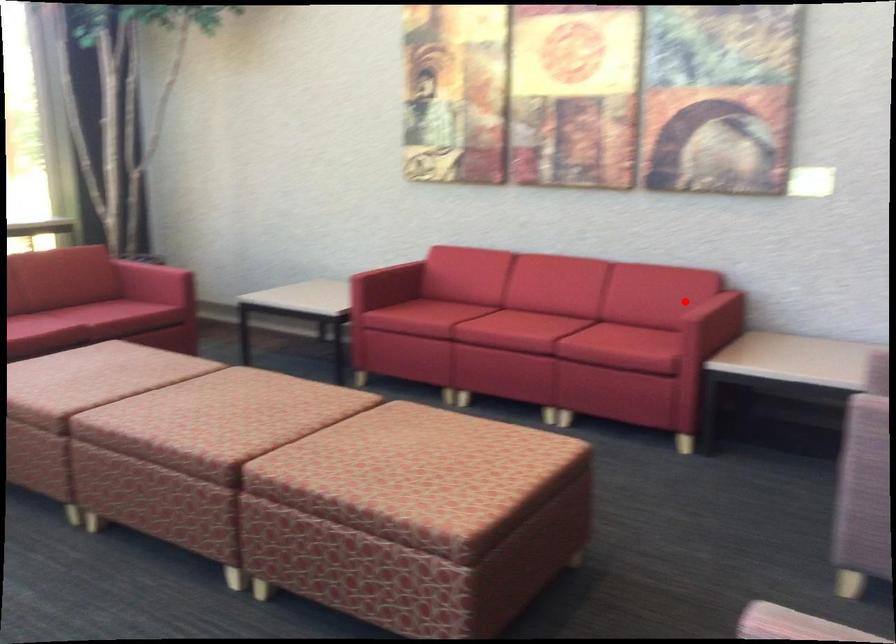
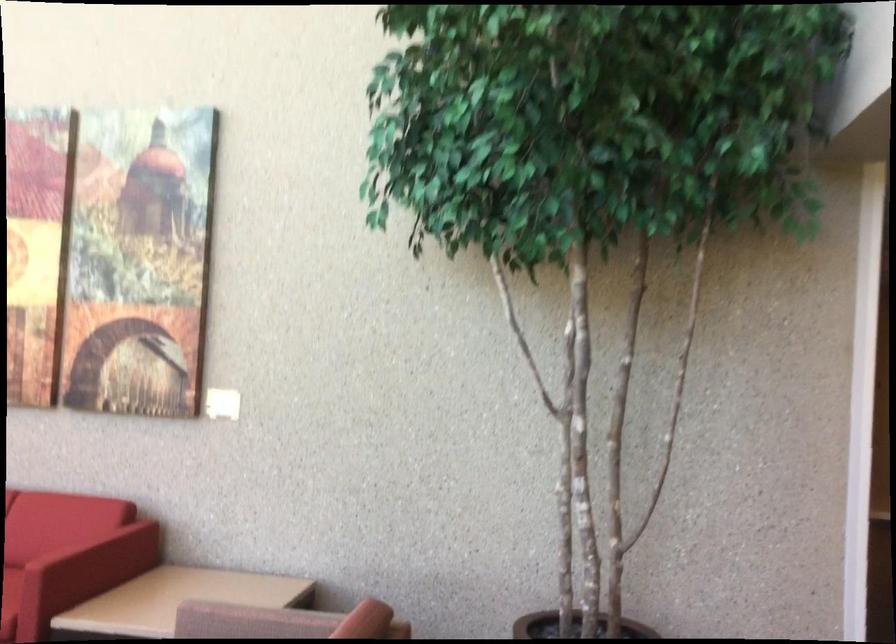
Question: I am providing you with two images of the same scene from different viewpoints. Image1 has a red point marked. In image2, the corresponding 3D location appears at what relative position? Reply with the corresponding letter.

Choices:
 (A) Closer
 (B) Farther

Answer: (A)